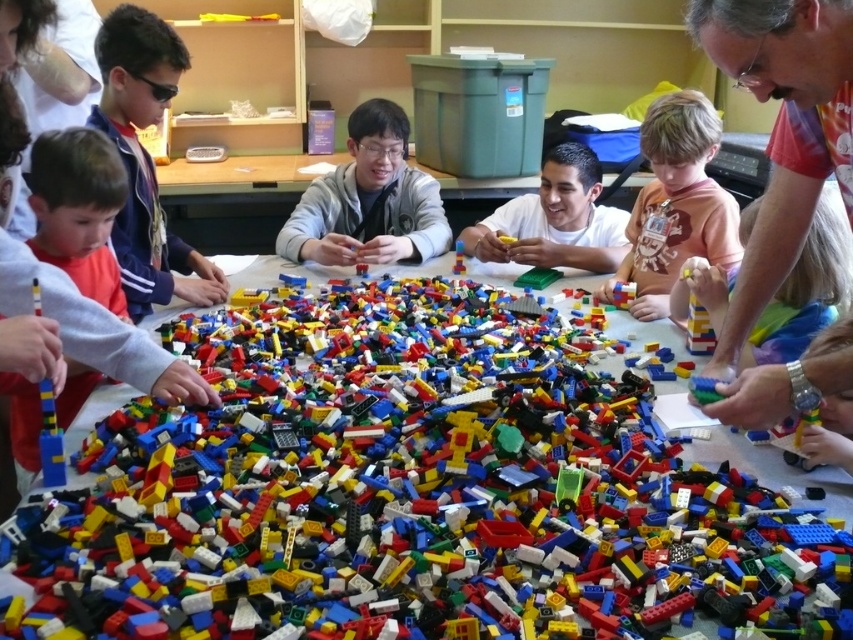
Who is more distant from viewer, [70,605] or [735,355]?

Point [735,355]

Find the location of a particular element. The image size is (853, 640). bright plastic lego bricks at center is located at coordinates (410, 492).

Is bright plastic lego bricks at center positioned in front of matte orange shirt at lower left?

Yes, it is.

From the picture: Can you confirm if bright plastic lego bricks at center is positioned to the left of matte orange shirt at lower left?

No, bright plastic lego bricks at center is not to the left of matte orange shirt at lower left.

Is point (335, 536) positioned before point (123, 296)?

Yes, point (335, 536) is in front of point (123, 296).

Image resolution: width=853 pixels, height=640 pixels. In order to click on bright plastic lego bricks at center in this screenshot , I will do `click(410, 492)`.

Is point (659, 131) behind point (514, 198)?

No.

Does smooth orange shirt at lower right have a larger size compared to matte plastic boy at center?

Indeed, smooth orange shirt at lower right has a larger size compared to matte plastic boy at center.

Does point (664, 145) lie in front of point (483, 224)?

Yes, point (664, 145) is closer to viewer.

This screenshot has width=853, height=640. I want to click on smooth orange shirt at lower right, so click(675, 204).